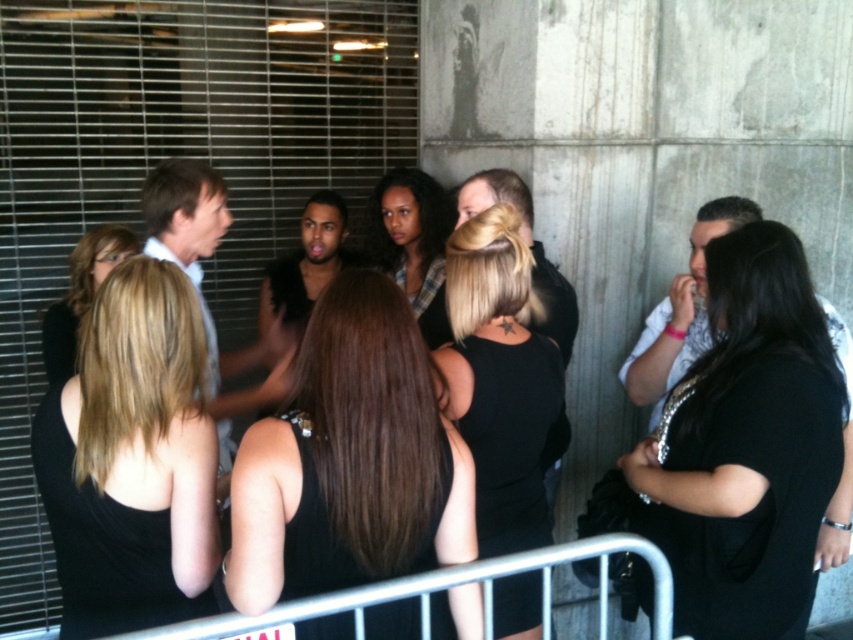
You are a photographer positioned at the origin point of the coordinate system. You need to capture a photo of the black sequined dress at right which is located at point 0.695, 0.876. What direction should you move your camera to focus on the dress?

The black sequined dress at right is located at coordinate point [746,444]. Since the photographer is at the origin, they should move the camera towards the upper right direction to focus on the dress.

You are a photographer trying to capture a candid shot of the group. You need to ensure there is enough space between the shiny black tank top at center and the black matte dress at center to avoid them overlapping in the photo. Given that your camera has a minimum focus distance of 12 inches, will the current spacing allow you to capture both clearly without overlapping?

The distance between the shiny black tank top at center and the black matte dress at center is 13.48 inches, which is greater than the camera minimum focus distance of 12 inches. Therefore, the spacing is sufficient to capture both clearly without overlapping.

You are organizing a clothing display and need to place the shiny black tank top at center and the black matte dress at center side by side. Based on their widths, which one should you place on the left to ensure they fit within the display area?

The shiny black tank top at center is wider than the black matte dress at center, so placing the tank top on the left and the dress on the right would allow both to fit within the display area without overlapping.